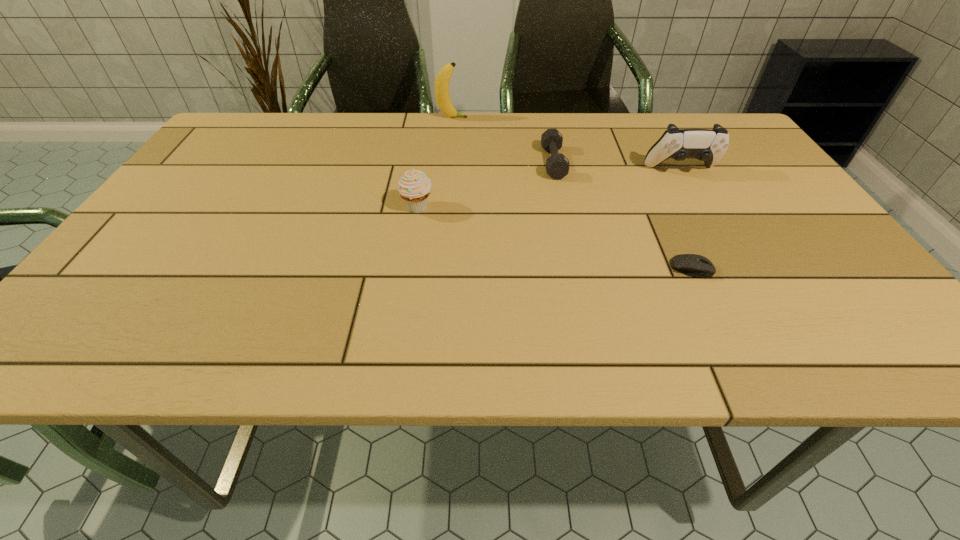
This screenshot has height=540, width=960. I want to click on the tallest object, so click(442, 80).

Where is `banana`? banana is located at coordinates (442, 80).

Where is `control`? This screenshot has height=540, width=960. control is located at coordinates tap(706, 145).

The width and height of the screenshot is (960, 540). Identify the location of the third shortest object. (414, 186).

The image size is (960, 540). Find the location of `muffin`. muffin is located at coordinates (414, 186).

Image resolution: width=960 pixels, height=540 pixels. What are the coordinates of `dumbbell` in the screenshot? It's located at (557, 165).

Where is `the third object from right to left`? This screenshot has width=960, height=540. the third object from right to left is located at coordinates (557, 165).

The image size is (960, 540). What are the coordinates of `the nearest object` in the screenshot? It's located at (695, 265).

Where is `the shortest object`? The height and width of the screenshot is (540, 960). the shortest object is located at coordinates (695, 265).

Image resolution: width=960 pixels, height=540 pixels. I want to click on blank area located from the stem of the farthest object, so click(548, 118).